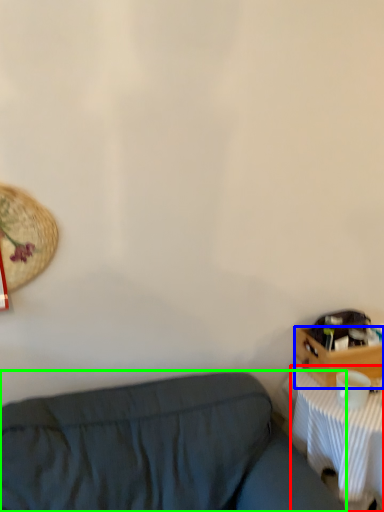
Question: Estimate the real-world distances between objects in this image. Which object is farther from desk (highlighted by a red box), drawer (highlighted by a blue box) or studio couch (highlighted by a green box)?

Choices:
 (A) drawer
 (B) studio couch

Answer: (B)